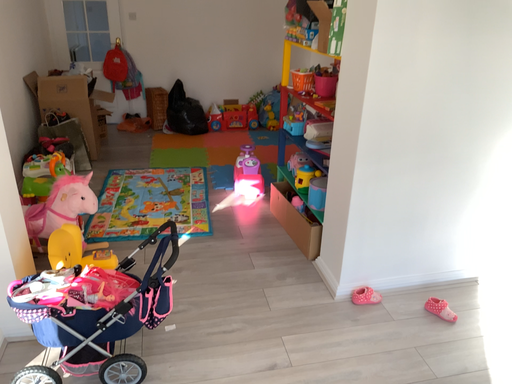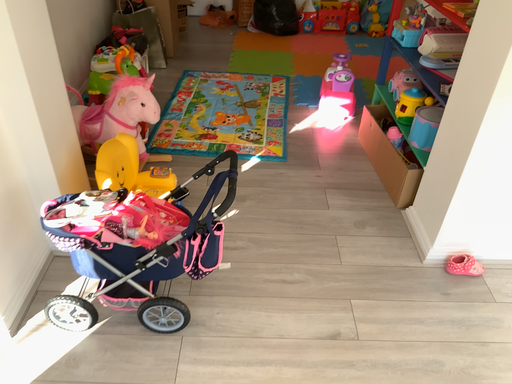
Question: Which way did the camera rotate in the video?

Choices:
 (A) rotated left
 (B) rotated right

Answer: (A)